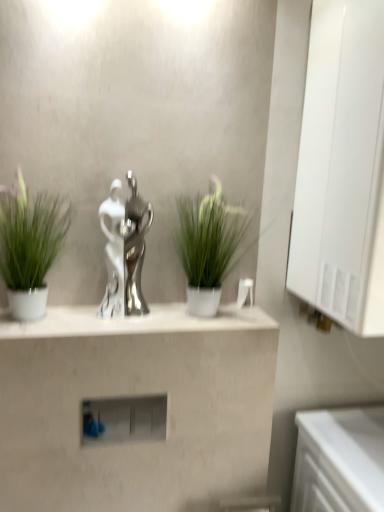
The width and height of the screenshot is (384, 512). In order to click on white glossy counter at lower right in this screenshot , I will do `click(339, 461)`.

At what (x,y) coordinates should I click in order to perform the action: click on silver metallic trophy at center. Please return your answer as a coordinate pair (x, y). Looking at the image, I should click on (125, 249).

How different are the orientations of white glossy medicine cabinet at right and green matte plant at left, which is counted as the 2th houseplant, starting from the right, in degrees?

The angular difference between white glossy medicine cabinet at right and green matte plant at left, which is counted as the 2th houseplant, starting from the right, is 0.767 degrees.

Is white glossy medicine cabinet at right inside the boundaries of green matte plant at left, which is counted as the first houseplant, starting from the left, or outside?

white glossy medicine cabinet at right is spatially situated outside green matte plant at left, which is counted as the first houseplant, starting from the left.

Can you confirm if white glossy medicine cabinet at right is taller than green matte plant at left, which is counted as the first houseplant, starting from the left?

Yes.

Find the location of a particular element. The image size is (384, 512). medicine cabinet above the green matte plant at left, which is counted as the 2th houseplant, starting from the right (from a real-world perspective) is located at coordinates (342, 168).

From the image's perspective, who appears lower, satin silver statue at center or green matte plant at left, which is counted as the first houseplant, starting from the left?

Result: satin silver statue at center, from the image's perspective.

Where is `mantle on the right of green matte plant at left, which is counted as the first houseplant, starting from the left`? The image size is (384, 512). mantle on the right of green matte plant at left, which is counted as the first houseplant, starting from the left is located at coordinates (133, 322).

Is point (144, 320) positioned behind point (7, 233)?

Yes, it is behind point (7, 233).

Does satin silver statue at center have a lesser height compared to green matte plant at left, which is counted as the 2th houseplant, starting from the right?

Yes, satin silver statue at center is shorter than green matte plant at left, which is counted as the 2th houseplant, starting from the right.

From the image's perspective, which one is positioned lower, green matte plant at center, the first houseplant when ordered from right to left, or white glossy counter at lower right?

white glossy counter at lower right.

Based on the photo, could you tell me if green matte plant at center, which is the 2th houseplant in left-to-right order, is turned towards white glossy counter at lower right?

No, green matte plant at center, which is the 2th houseplant in left-to-right order, is not facing towards white glossy counter at lower right.

Is white glossy counter at lower right surrounded by green matte plant at center, the first houseplant when ordered from right to left?

No, white glossy counter at lower right is located outside of green matte plant at center, the first houseplant when ordered from right to left.

Is the position of green matte plant at center, which is the 2th houseplant in left-to-right order, less distant than that of white glossy counter at lower right?

No, it is behind white glossy counter at lower right.

Looking at their sizes, would you say green matte plant at left, which is counted as the first houseplant, starting from the left, is wider or thinner than matte white shelf at center?

Considering their sizes, green matte plant at left, which is counted as the first houseplant, starting from the left, looks broader than matte white shelf at center.

Based on the photo, is green matte plant at left, which is counted as the 2th houseplant, starting from the right, to the left or to the right of matte white shelf at center in the image?

green matte plant at left, which is counted as the 2th houseplant, starting from the right, is positioned on matte white shelf at center's left side.

Is matte white shelf at center located within green matte plant at left, which is counted as the 2th houseplant, starting from the right?

Definitely not — matte white shelf at center is not inside green matte plant at left, which is counted as the 2th houseplant, starting from the right.

Find the location of a particular element. The width and height of the screenshot is (384, 512). houseplant that is the 2nd object located above the matte white shelf at center (from the image's perspective) is located at coordinates (29, 247).

Which object is thinner, white glossy counter at lower right or matte white shelf at center?

matte white shelf at center.

Does point (373, 450) come in front of point (158, 408)?

Yes, point (373, 450) is closer to viewer.

From a real-world perspective, which object stands above the other?

matte white shelf at center, from a real-world perspective.

Which is in front, white glossy counter at lower right or matte white shelf at center?

white glossy counter at lower right is more forward.

From the image's perspective, is satin silver statue at center located beneath white glossy counter at lower right?

Incorrect, from the image's perspective, satin silver statue at center is higher than white glossy counter at lower right.

Is satin silver statue at center to the left or to the right of white glossy counter at lower right in the image?

satin silver statue at center is positioned on white glossy counter at lower right's left side.

Between point (44, 320) and point (358, 484), which one is positioned behind?

Point (44, 320)

Between satin silver statue at center and white glossy counter at lower right, which one has less height?

With less height is satin silver statue at center.

From the image's perspective, is satin silver statue at center on silver metallic trophy at center?

Incorrect, from the image's perspective, satin silver statue at center is lower than silver metallic trophy at center.

You are a GUI agent. You are given a task and a screenshot of the screen. Output one action in this format:
    pyautogui.click(x=<x>, y=<y>)
    Task: Click on the tap behind the satin silver statue at center
    The height and width of the screenshot is (512, 384).
    Given the screenshot: What is the action you would take?
    pyautogui.click(x=125, y=249)

Could you tell me if satin silver statue at center is facing silver metallic trophy at center?

No, satin silver statue at center is not turned towards silver metallic trophy at center.

I want to click on medicine cabinet that is on the right side of green matte plant at left, which is counted as the first houseplant, starting from the left, so tap(342, 168).

From the image's perspective, starting from the satin silver statue at center, which houseplant is the 2nd one above? Please provide its 2D coordinates.

[(29, 247)]

Estimate the real-world distances between objects in this image. Which object is closer to matte white shelf at center, white glossy medicine cabinet at right or silver metallic trophy at center?

silver metallic trophy at center is positioned closer to the anchor matte white shelf at center.

Based on their spatial positions, is green matte plant at center, the first houseplant when ordered from right to left, or silver metallic trophy at center further from white glossy counter at lower right?

silver metallic trophy at center is positioned further to the anchor white glossy counter at lower right.

Which object lies further to the anchor point white glossy medicine cabinet at right, satin silver statue at center or green matte plant at center, which is the 2th houseplant in left-to-right order?

The object further to white glossy medicine cabinet at right is satin silver statue at center.

Considering their positions, is green matte plant at center, which is the 2th houseplant in left-to-right order, positioned closer to white glossy medicine cabinet at right than satin silver statue at center?

green matte plant at center, which is the 2th houseplant in left-to-right order, is closer to white glossy medicine cabinet at right.

Based on their spatial positions, is green matte plant at left, which is counted as the first houseplant, starting from the left, or green matte plant at center, the first houseplant when ordered from right to left, closer to silver metallic trophy at center?

Among the two, green matte plant at center, the first houseplant when ordered from right to left, is located nearer to silver metallic trophy at center.

Which object lies further to the anchor point satin silver statue at center, green matte plant at left, which is counted as the first houseplant, starting from the left, or white glossy counter at lower right?

Based on the image, white glossy counter at lower right appears to be further to satin silver statue at center.

When comparing their distances from matte white shelf at center, does white glossy counter at lower right or satin silver statue at center seem further?

Based on the image, satin silver statue at center appears to be further to matte white shelf at center.

Based on their spatial positions, is silver metallic trophy at center or white glossy medicine cabinet at right further from matte white shelf at center?

white glossy medicine cabinet at right.

At what (x,y) coordinates should I click in order to perform the action: click on mantle that lies between green matte plant at left, which is counted as the 2th houseplant, starting from the right, and matte white shelf at center from top to bottom. Please return your answer as a coordinate pair (x, y). Looking at the image, I should click on (133, 322).

This screenshot has height=512, width=384. Identify the location of mantle between matte white shelf at center and white glossy medicine cabinet at right. [133, 322].

Identify the location of shelf between white glossy medicine cabinet at right and white glossy counter at lower right vertically. Image resolution: width=384 pixels, height=512 pixels. (124, 419).

Find the location of a particular element. The width and height of the screenshot is (384, 512). tap between green matte plant at left, which is counted as the 2th houseplant, starting from the right, and white glossy counter at lower right, in the horizontal direction is located at coordinates (125, 249).